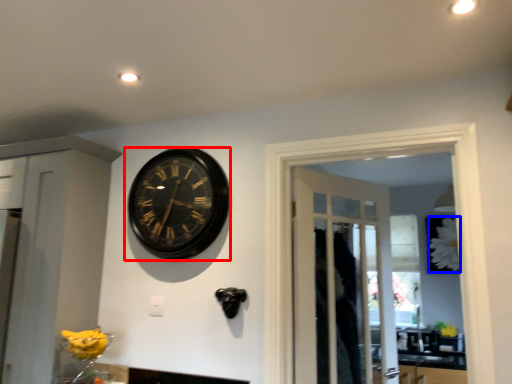
Question: Which point is further to the camera, wall clock (highlighted by a red box) or flower (highlighted by a blue box)?

Choices:
 (A) wall clock
 (B) flower

Answer: (B)